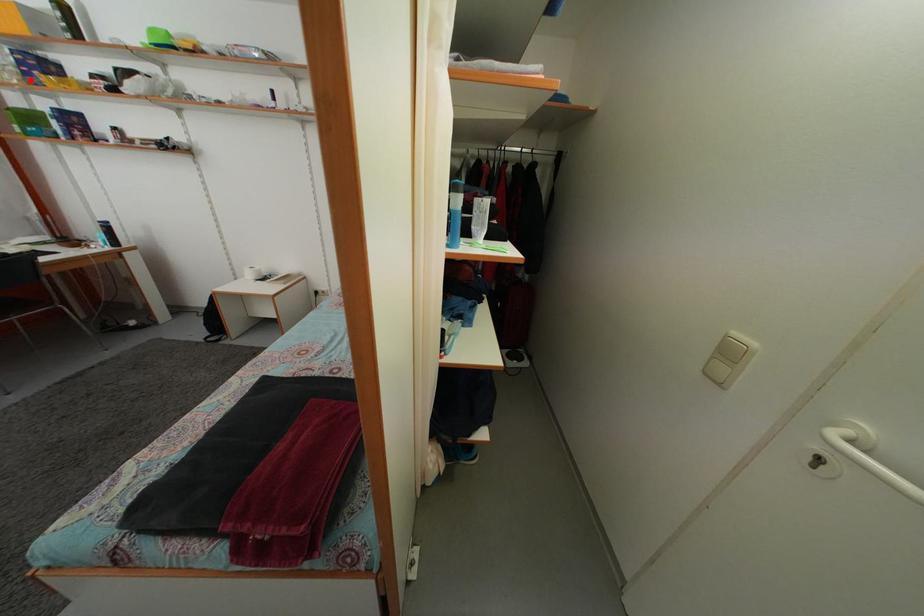
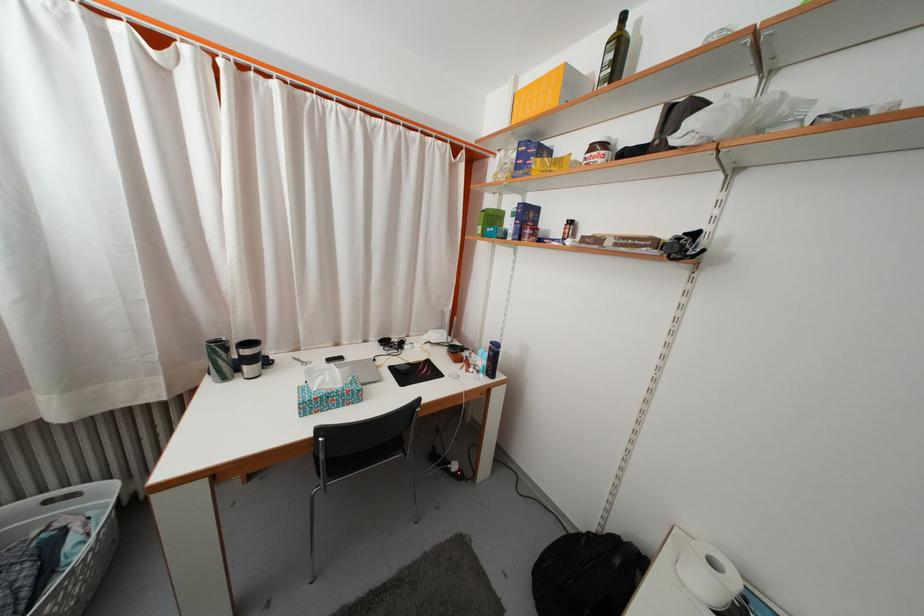
Where in the second image is the point corresponding to the highlighted location from the first image?

(523, 175)